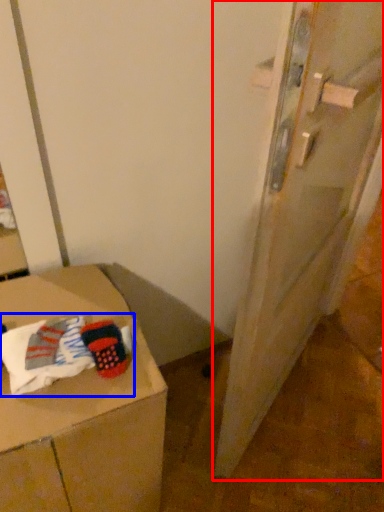
Question: Among these objects, which one is nearest to the camera, door (highlighted by a red box) or laundry (highlighted by a blue box)?

Choices:
 (A) door
 (B) laundry

Answer: (A)